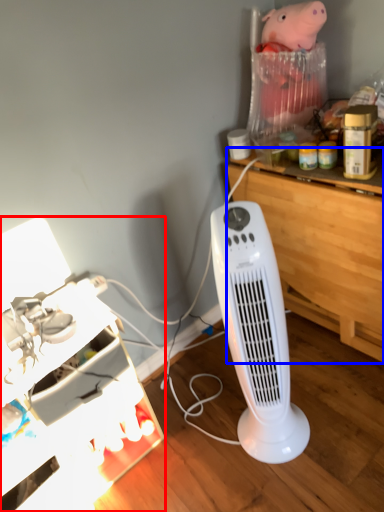
Question: Which point is closer to the camera, furniture (highlighted by a red box) or computer desk (highlighted by a blue box)?

Choices:
 (A) furniture
 (B) computer desk

Answer: (A)